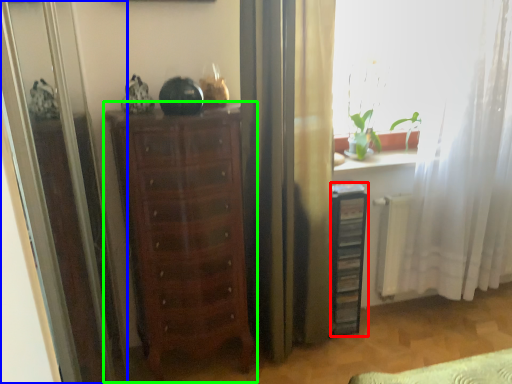
Question: Which object is positioned closest to file cabinet (highlighted by a red box)? Select from screen door (highlighted by a blue box) and chest of drawers (highlighted by a green box).

Choices:
 (A) screen door
 (B) chest of drawers

Answer: (B)